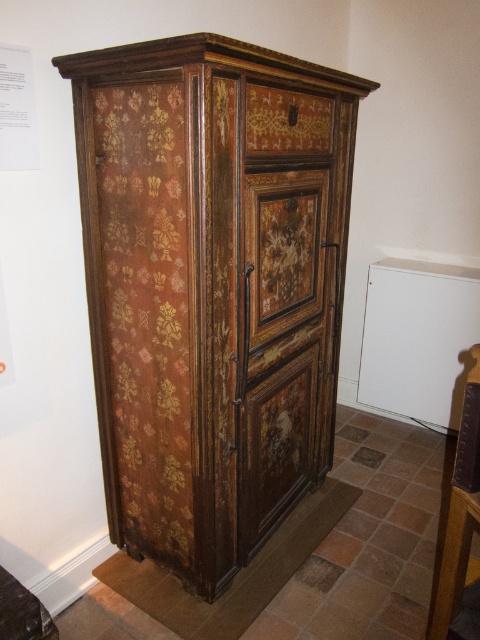
You are standing in front of the antique wooden cabinet and notice two points marked on its surface. The first point is at coordinate point (324, 147) and the second is at point (300, 330). Which point is closer to you?

Point (324, 147) is in front of point (300, 330), so it is closer to you.